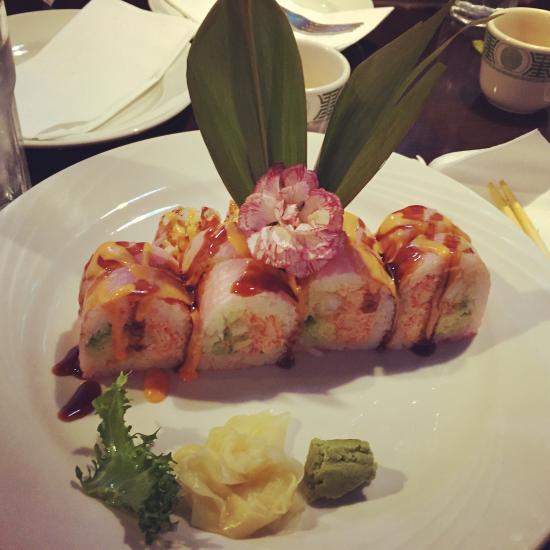
At what (x,y) coordinates should I click in order to perform the action: click on plate. Please return your answer as a coordinate pair (x, y). This screenshot has height=550, width=550. Looking at the image, I should click on (177, 183), (160, 102), (164, 6).